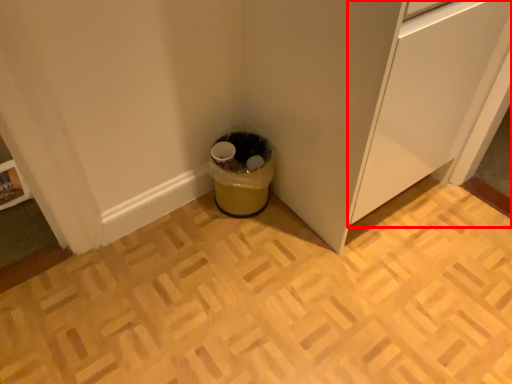
Question: From the image, what is the correct spatial relationship of cabinetry (annotated by the red box) in relation to waste container?

Choices:
 (A) left
 (B) right

Answer: (B)